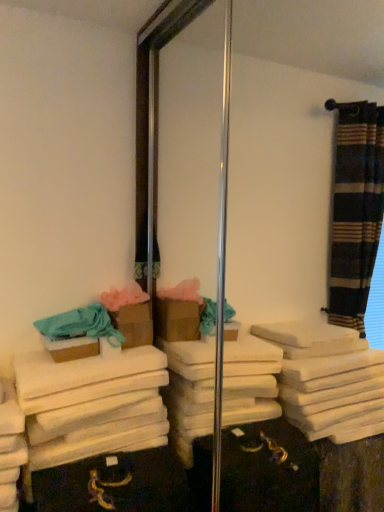
Question: Can you confirm if white soft towel at lower left, marked as the first bath towel in a bottom-to-top arrangement, is smaller than brown cardboard box at left, which is the 2th box in front-to-back order?

Choices:
 (A) yes
 (B) no

Answer: (B)

Question: From a real-world perspective, is white soft towel at lower left, marked as the first bath towel in a bottom-to-top arrangement, located higher than brown cardboard box at left, which is the 2th box in front-to-back order?

Choices:
 (A) no
 (B) yes

Answer: (A)

Question: Is white soft towel at lower left, marked as the first bath towel in a bottom-to-top arrangement, oriented away from brown cardboard box at left, which is the 2th box in front-to-back order?

Choices:
 (A) no
 (B) yes

Answer: (A)

Question: Is white soft towel at lower left, the 2th bath towel from the top, bigger than brown cardboard box at left, which is the 2th box in front-to-back order?

Choices:
 (A) no
 (B) yes

Answer: (B)

Question: From the image's perspective, is white soft towel at lower left, marked as the first bath towel in a bottom-to-top arrangement, on top of brown cardboard box at left, marked as the 1th box in a back-to-front arrangement?

Choices:
 (A) yes
 (B) no

Answer: (B)

Question: Is white soft towel at lower left, the 2th bath towel from the top, at the right side of brown cardboard box at left, which is the 2th box in front-to-back order?

Choices:
 (A) no
 (B) yes

Answer: (A)

Question: From the image's perspective, is brown cardboard box at left, which is the 2th box in front-to-back order, on teal cotton bath towel at left, marked as the second bath towel in a bottom-to-top arrangement?

Choices:
 (A) yes
 (B) no

Answer: (A)

Question: Could you tell me if brown cardboard box at left, marked as the 1th box in a back-to-front arrangement, is facing teal cotton bath towel at left, marked as the second bath towel in a bottom-to-top arrangement?

Choices:
 (A) yes
 (B) no

Answer: (B)

Question: Would you say brown cardboard box at left, which is the 2th box in front-to-back order, is a long distance from teal cotton bath towel at left, marked as the second bath towel in a bottom-to-top arrangement?

Choices:
 (A) no
 (B) yes

Answer: (A)

Question: Does brown cardboard box at left, which is the 2th box in front-to-back order, have a lesser width compared to teal cotton bath towel at left, marked as the second bath towel in a bottom-to-top arrangement?

Choices:
 (A) no
 (B) yes

Answer: (B)

Question: Considering the relative sizes of brown cardboard box at left, which is the 2th box in front-to-back order, and teal cotton bath towel at left, marked as the second bath towel in a bottom-to-top arrangement, in the image provided, is brown cardboard box at left, which is the 2th box in front-to-back order, bigger than teal cotton bath towel at left, marked as the second bath towel in a bottom-to-top arrangement,?

Choices:
 (A) no
 (B) yes

Answer: (A)

Question: From a real-world perspective, is brown cardboard box at left, which is the 2th box in front-to-back order, physically above teal cotton bath towel at left, which is the first bath towel from top to bottom?

Choices:
 (A) no
 (B) yes

Answer: (A)

Question: Does brown cardboard box at center, positioned as the 2th box in back-to-front order, turn towards teal cotton bath towel at left, which is the first bath towel from top to bottom?

Choices:
 (A) no
 (B) yes

Answer: (B)